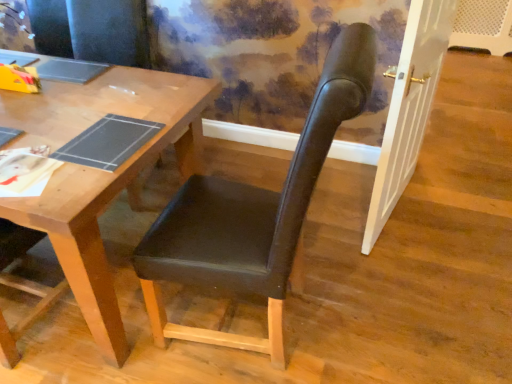
Question: Considering the relative sizes of wooden desk at center and black leather chair at center in the image provided, is wooden desk at center shorter than black leather chair at center?

Choices:
 (A) no
 (B) yes

Answer: (B)

Question: From the image's perspective, is wooden desk at center located above black leather chair at center?

Choices:
 (A) no
 (B) yes

Answer: (B)

Question: Considering the relative sizes of wooden desk at center and black leather chair at center in the image provided, is wooden desk at center wider than black leather chair at center?

Choices:
 (A) yes
 (B) no

Answer: (A)

Question: Is wooden desk at center bigger than black leather chair at center?

Choices:
 (A) yes
 (B) no

Answer: (A)

Question: From a real-world perspective, is wooden desk at center on black leather chair at center?

Choices:
 (A) no
 (B) yes

Answer: (A)

Question: From the image's perspective, is wooden desk at center under black leather chair at center?

Choices:
 (A) no
 (B) yes

Answer: (A)

Question: Is black leather chair at center shorter than wooden desk at center?

Choices:
 (A) no
 (B) yes

Answer: (A)

Question: Is black leather chair at center next to wooden desk at center and touching it?

Choices:
 (A) no
 (B) yes

Answer: (A)

Question: Is black leather chair at center oriented away from wooden desk at center?

Choices:
 (A) yes
 (B) no

Answer: (B)

Question: Could wooden desk at center be considered to be inside black leather chair at center?

Choices:
 (A) no
 (B) yes

Answer: (A)

Question: From a real-world perspective, is black leather chair at center on wooden desk at center?

Choices:
 (A) no
 (B) yes

Answer: (B)

Question: Is black leather chair at center positioned behind wooden desk at center?

Choices:
 (A) no
 (B) yes

Answer: (A)

Question: From the image's perspective, is black leather chair at center located above or below wooden desk at center?

Choices:
 (A) above
 (B) below

Answer: (B)